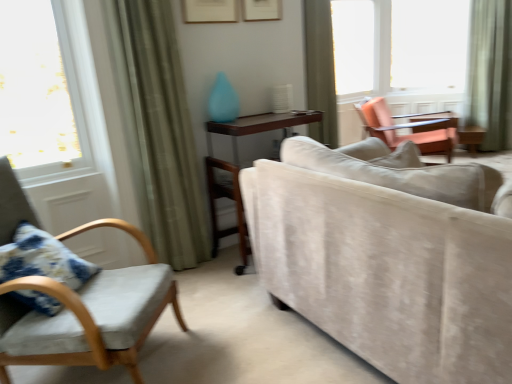
What do you see at coordinates (399, 47) in the screenshot?
I see `transparent glass window at upper right, placed as the 2th window when sorted from left to right` at bounding box center [399, 47].

In order to face beige velvet couch at center, should I rotate leftwards or rightwards?

You should look right and rotate roughly 21.120 degrees.

What do you see at coordinates (489, 70) in the screenshot?
I see `green fabric curtain at right, placed as the 3th curtain when sorted from front to back` at bounding box center [489, 70].

Describe the element at coordinates (320, 70) in the screenshot. I see `green fabric curtain at upper center, arranged as the second curtain when viewed from the right` at that location.

You are a GUI agent. You are given a task and a screenshot of the screen. Output one action in this format:
    pyautogui.click(x=<x>, y=<y>)
    Task: Click on the velvet cushioned chair at left, marked as the 2th chair in a right-to-left arrangement
    
    Given the screenshot: What is the action you would take?
    pyautogui.click(x=89, y=314)

This screenshot has height=384, width=512. I want to click on transparent glass window at upper right, placed as the 2th window when sorted from left to right, so click(x=399, y=47).

Considering the relative positions of matte glass vase at upper center and wooden table at center in the image provided, is matte glass vase at upper center to the left of wooden table at center from the viewer's perspective?

Yes.

Would you consider matte glass vase at upper center to be distant from wooden table at center?

matte glass vase at upper center is near wooden table at center, not far away.

Where is `table to the right of matte glass vase at upper center`? table to the right of matte glass vase at upper center is located at coordinates (239, 166).

Is matte glass vase at upper center closer to the viewer compared to wooden table at center?

That is False.

Which object is positioned more to the right, green fabric curtain at left, which is the 1th curtain in front-to-back order, or green fabric curtain at upper center, positioned as the 2th curtain in back-to-front order?

From the viewer's perspective, green fabric curtain at upper center, positioned as the 2th curtain in back-to-front order, appears more on the right side.

This screenshot has width=512, height=384. Identify the location of curtain in front of the green fabric curtain at upper center, positioned as the 2th curtain in back-to-front order. (158, 129).

From the image's perspective, which is below, green fabric curtain at left, which is the 1th curtain in front-to-back order, or green fabric curtain at upper center, the second curtain in the left-to-right sequence?

green fabric curtain at left, which is the 1th curtain in front-to-back order, appears lower in the image.

Would you consider green fabric curtain at left, the 1th curtain positioned from the left, to be distant from green fabric curtain at upper center, the second curtain in the left-to-right sequence?

green fabric curtain at left, the 1th curtain positioned from the left, is far away from green fabric curtain at upper center, the second curtain in the left-to-right sequence.

Which object is positioned more to the left, green fabric curtain at upper center, arranged as the second curtain when viewed from the right, or transparent glass window at upper right, placed as the 2th window when sorted from left to right?

From the viewer's perspective, green fabric curtain at upper center, arranged as the second curtain when viewed from the right, appears more on the left side.

Who is shorter, green fabric curtain at upper center, positioned as the 2th curtain in back-to-front order, or transparent glass window at upper right, marked as the first window in a right-to-left arrangement?

With less height is transparent glass window at upper right, marked as the first window in a right-to-left arrangement.

From the green fabric curtain at upper center, positioned as the 2th curtain in back-to-front order, count 2nd windows backward and point to it. Please provide its 2D coordinates.

[(399, 47)]

From a real-world perspective, does green fabric curtain at upper center, positioned as the 2th curtain in back-to-front order, stand above transparent glass window at upper right, marked as the first window in a right-to-left arrangement?

Incorrect, from a real-world perspective, green fabric curtain at upper center, positioned as the 2th curtain in back-to-front order, is lower than transparent glass window at upper right, marked as the first window in a right-to-left arrangement.

Is beige velvet couch at center not inside green fabric curtain at right, the first curtain positioned from the back?

beige velvet couch at center is positioned outside green fabric curtain at right, the first curtain positioned from the back.

Considering the points (269, 222) and (499, 82), which point is behind, point (269, 222) or point (499, 82)?

The point (499, 82) is farther from the camera.

Which object is closer to the camera taking this photo, beige velvet couch at center or green fabric curtain at right, the first curtain positioned from the back?

beige velvet couch at center is more forward.

Is beige velvet couch at center placed right next to green fabric curtain at right, the first curtain positioned from the back?

No, beige velvet couch at center is not beside green fabric curtain at right, the first curtain positioned from the back.

From the image's perspective, is transparent glass window at upper right, marked as the first window in a right-to-left arrangement, under green fabric curtain at left, which is the 1th curtain in front-to-back order?

Actually, transparent glass window at upper right, marked as the first window in a right-to-left arrangement, appears above green fabric curtain at left, which is the 1th curtain in front-to-back order, in the image.

From a real-world perspective, is transparent glass window at upper right, placed as the 2th window when sorted from left to right, beneath green fabric curtain at left, the 1th curtain positioned from the left?

No, from a real-world perspective, transparent glass window at upper right, placed as the 2th window when sorted from left to right, is not beneath green fabric curtain at left, the 1th curtain positioned from the left.

Between transparent glass window at upper right, marked as the first window in a right-to-left arrangement, and green fabric curtain at left, which is the 1th curtain in front-to-back order, which one has larger width?

Wider between the two is transparent glass window at upper right, marked as the first window in a right-to-left arrangement.

Who is smaller, green fabric curtain at upper center, arranged as the second curtain when viewed from the right, or green fabric curtain at right, placed as the 3th curtain when sorted from front to back?

green fabric curtain at right, placed as the 3th curtain when sorted from front to back, is smaller.

Is green fabric curtain at upper center, acting as the second curtain starting from the front, thinner than green fabric curtain at right, arranged as the 3th curtain when viewed from the left?

In fact, green fabric curtain at upper center, acting as the second curtain starting from the front, might be wider than green fabric curtain at right, arranged as the 3th curtain when viewed from the left.

Is the surface of green fabric curtain at upper center, the second curtain in the left-to-right sequence, in direct contact with green fabric curtain at right, which is the 1th curtain in right-to-left order?

There is a gap between green fabric curtain at upper center, the second curtain in the left-to-right sequence, and green fabric curtain at right, which is the 1th curtain in right-to-left order.

Who is taller, green fabric curtain at upper center, acting as the second curtain starting from the front, or green fabric curtain at right, placed as the 3th curtain when sorted from front to back?

With more height is green fabric curtain at right, placed as the 3th curtain when sorted from front to back.

From a real-world perspective, which object rests below the other?

green fabric curtain at right, placed as the 3th curtain when sorted from front to back.

From the image's perspective, which is above, matte glass vase at upper center or green fabric curtain at right, placed as the 3th curtain when sorted from front to back?

green fabric curtain at right, placed as the 3th curtain when sorted from front to back, is shown above in the image.

Can you confirm if matte glass vase at upper center is thinner than green fabric curtain at right, placed as the 3th curtain when sorted from front to back?

Correct, the width of matte glass vase at upper center is less than that of green fabric curtain at right, placed as the 3th curtain when sorted from front to back.

Is matte glass vase at upper center positioned with its back to green fabric curtain at right, arranged as the 3th curtain when viewed from the left?

No, green fabric curtain at right, arranged as the 3th curtain when viewed from the left, is not at the back of matte glass vase at upper center.

Where is `turquoise above the wooden table at center (from the image's perspective)`? This screenshot has height=384, width=512. turquoise above the wooden table at center (from the image's perspective) is located at coordinates coord(223,100).

From the green fabric curtain at left, the third curtain in the right-to-left sequence, count 1st curtain to the right and point to it. Please provide its 2D coordinates.

[(320, 70)]

From the image, which object appears to be nearer to matte orange chair at upper right, the first chair from the right, green fabric curtain at right, arranged as the 3th curtain when viewed from the left, or velvet cushioned chair at left, arranged as the 1th chair when viewed from the front?

green fabric curtain at right, arranged as the 3th curtain when viewed from the left, lies closer to matte orange chair at upper right, the first chair from the right, than the other object.

When comparing their distances from blue floral fabric pillow at lower left, does green fabric curtain at left, the third curtain in the right-to-left sequence, or transparent glass window at upper right, which appears as the second window when viewed from the right, seem closer?

Among the two, green fabric curtain at left, the third curtain in the right-to-left sequence, is located nearer to blue floral fabric pillow at lower left.

When comparing their distances from green fabric curtain at right, the first curtain positioned from the back, does green fabric curtain at upper center, acting as the second curtain starting from the front, or matte glass vase at upper center seem closer?

Among the two, green fabric curtain at upper center, acting as the second curtain starting from the front, is located nearer to green fabric curtain at right, the first curtain positioned from the back.

From the image, which object appears to be farther from transparent glass window at upper right, placed as the 2th window when sorted from left to right, green fabric curtain at right, the first curtain positioned from the back, or green fabric curtain at left, acting as the third curtain starting from the back?

Based on the image, green fabric curtain at left, acting as the third curtain starting from the back, appears to be further to transparent glass window at upper right, placed as the 2th window when sorted from left to right.

Estimate the real-world distances between objects in this image. Which object is further from transparent glass window at upper right, which appears as the 1th window when viewed from the left, velvet cushioned chair at left, which is the 2th chair in top-to-bottom order, or matte orange chair at upper right, the first chair from the right?

The object further to transparent glass window at upper right, which appears as the 1th window when viewed from the left, is velvet cushioned chair at left, which is the 2th chair in top-to-bottom order.

From the image, which object appears to be nearer to green fabric curtain at right, arranged as the 3th curtain when viewed from the left, matte glass vase at upper center or green fabric curtain at upper center, arranged as the second curtain when viewed from the right?

Based on the image, green fabric curtain at upper center, arranged as the second curtain when viewed from the right, appears to be nearer to green fabric curtain at right, arranged as the 3th curtain when viewed from the left.

From the picture: Considering their positions, is green fabric curtain at upper center, acting as the second curtain starting from the front, positioned further to transparent glass window at upper right, marked as the first window in a right-to-left arrangement, than velvet cushioned chair at left, marked as the 2th chair in a right-to-left arrangement?

velvet cushioned chair at left, marked as the 2th chair in a right-to-left arrangement, is positioned further to the anchor transparent glass window at upper right, marked as the first window in a right-to-left arrangement.

Estimate the real-world distances between objects in this image. Which object is further from green fabric curtain at upper center, positioned as the 2th curtain in back-to-front order, blue floral fabric pillow at lower left or beige velvet couch at center?

Among the two, blue floral fabric pillow at lower left is located further to green fabric curtain at upper center, positioned as the 2th curtain in back-to-front order.

What are the coordinates of `pillow between velvet cushioned chair at left, the 2th chair positioned from the back, and transparent glass window at upper right, which appears as the second window when viewed from the right, from front to back` in the screenshot? It's located at (42, 258).

Image resolution: width=512 pixels, height=384 pixels. Identify the location of curtain between blue floral fabric pillow at lower left and green fabric curtain at upper center, arranged as the second curtain when viewed from the right, from left to right. (158, 129).

The height and width of the screenshot is (384, 512). In order to click on table between beige velvet couch at center and transparent glass window at upper right, marked as the first window in a right-to-left arrangement, along the z-axis in this screenshot , I will do `click(239, 166)`.

You are a GUI agent. You are given a task and a screenshot of the screen. Output one action in this format:
    pyautogui.click(x=<x>, y=<y>)
    Task: Click on the turquoise positioned between wooden table at center and transparent glass window at upper right, marked as the first window in a right-to-left arrangement, from near to far
    This screenshot has width=512, height=384.
    Given the screenshot: What is the action you would take?
    pyautogui.click(x=223, y=100)